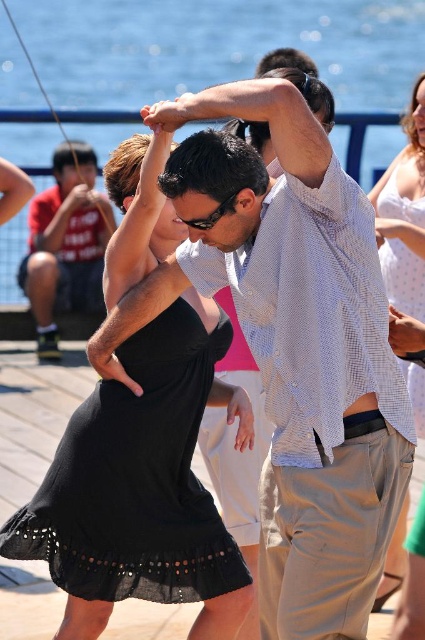
You are a photographer at the dance event. You need to capture a photo that includes both the light blue woven shirt at center and the black chiffon dress at right. Based on their positions, which one should be positioned to the left in the frame to include both in the shot?

The light blue woven shirt at center is already to the left of the black chiffon dress at right, so positioning the light blue woven shirt at center on the left side of the frame and the black chiffon dress at right on the right side will include both in the shot.